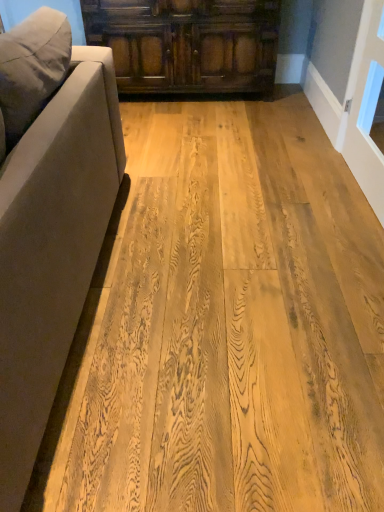
Question: Does suede-like beige couch at left lie behind dark brown wood cabinet at upper center?

Choices:
 (A) no
 (B) yes

Answer: (A)

Question: Is suede-like beige couch at left bigger than dark brown wood cabinet at upper center?

Choices:
 (A) yes
 (B) no

Answer: (A)

Question: Is suede-like beige couch at left facing away from dark brown wood cabinet at upper center?

Choices:
 (A) yes
 (B) no

Answer: (A)

Question: Considering the relative sizes of suede-like beige couch at left and dark brown wood cabinet at upper center in the image provided, is suede-like beige couch at left shorter than dark brown wood cabinet at upper center?

Choices:
 (A) yes
 (B) no

Answer: (B)

Question: Is suede-like beige couch at left not near dark brown wood cabinet at upper center?

Choices:
 (A) yes
 (B) no

Answer: (A)

Question: Considering the positions of suede-like beige couch at left and dark brown wood cabinet at upper center in the image, is suede-like beige couch at left wider or thinner than dark brown wood cabinet at upper center?

Choices:
 (A) wide
 (B) thin

Answer: (A)

Question: From a real-world perspective, relative to dark brown wood cabinet at upper center, is suede-like beige couch at left vertically above or below?

Choices:
 (A) above
 (B) below

Answer: (A)

Question: Choose the correct answer: Is suede-like beige couch at left inside dark brown wood cabinet at upper center or outside it?

Choices:
 (A) outside
 (B) inside

Answer: (A)

Question: Considering their positions, is suede-like beige couch at left located in front of or behind dark brown wood cabinet at upper center?

Choices:
 (A) front
 (B) behind

Answer: (A)

Question: In terms of width, does suede-like beige couch at left look wider or thinner when compared to natural wood floor at center?

Choices:
 (A) wide
 (B) thin

Answer: (A)

Question: From a real-world perspective, is suede-like beige couch at left above or below natural wood floor at center?

Choices:
 (A) above
 (B) below

Answer: (A)

Question: Based on their positions, is suede-like beige couch at left located to the left or right of natural wood floor at center?

Choices:
 (A) left
 (B) right

Answer: (A)

Question: Is point (44, 343) positioned closer to the camera than point (279, 209)?

Choices:
 (A) closer
 (B) farther

Answer: (A)

Question: Is natural wood floor at center wider or thinner than suede-like beige couch at left?

Choices:
 (A) wide
 (B) thin

Answer: (B)

Question: From a real-world perspective, is natural wood floor at center above or below suede-like beige couch at left?

Choices:
 (A) below
 (B) above

Answer: (A)